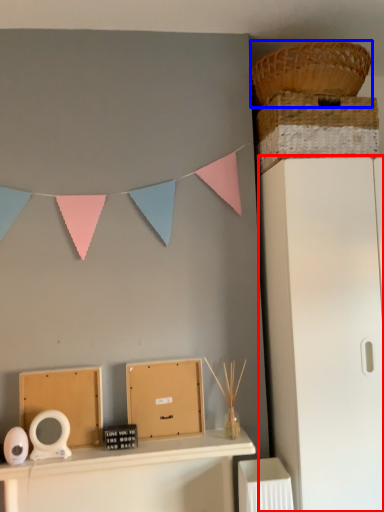
Question: Which point is closer to the camera, file cabinet (highlighted by a red box) or basket (highlighted by a blue box)?

Choices:
 (A) file cabinet
 (B) basket

Answer: (A)